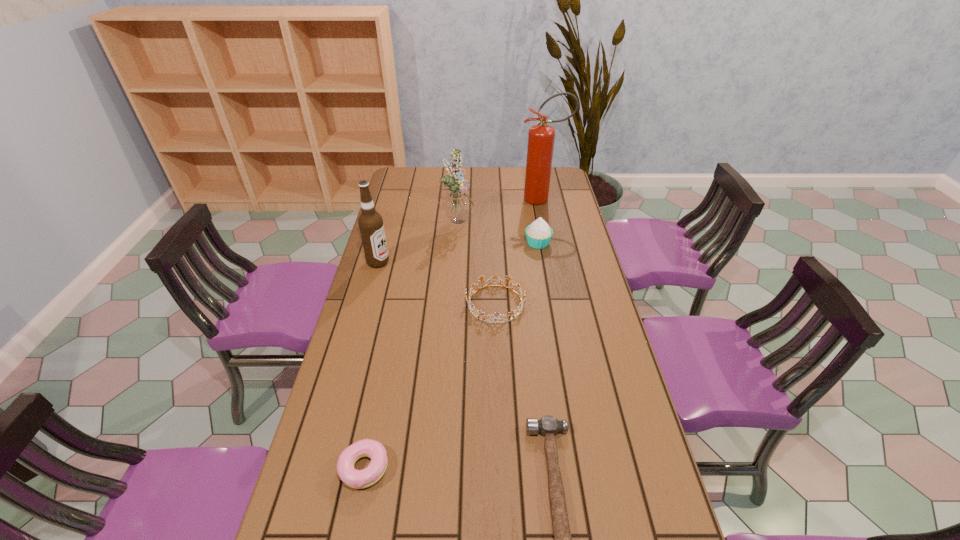
Identify the location of vacant area that lies between the second object from left to right and the fourth nearest object. (372, 365).

This screenshot has height=540, width=960. In order to click on free space between the cupcake and the alcohol in this screenshot , I will do `click(458, 253)`.

Identify the location of object that ranks as the third closest to the tiara. (458, 205).

Where is `the closest object relative to the hammer`? the closest object relative to the hammer is located at coordinates (358, 479).

Image resolution: width=960 pixels, height=540 pixels. I want to click on vacant space that satisfies the following two spatial constraints: 1. from the nozzle of the farthest object; 2. on the front side of the third farthest object, so click(x=551, y=243).